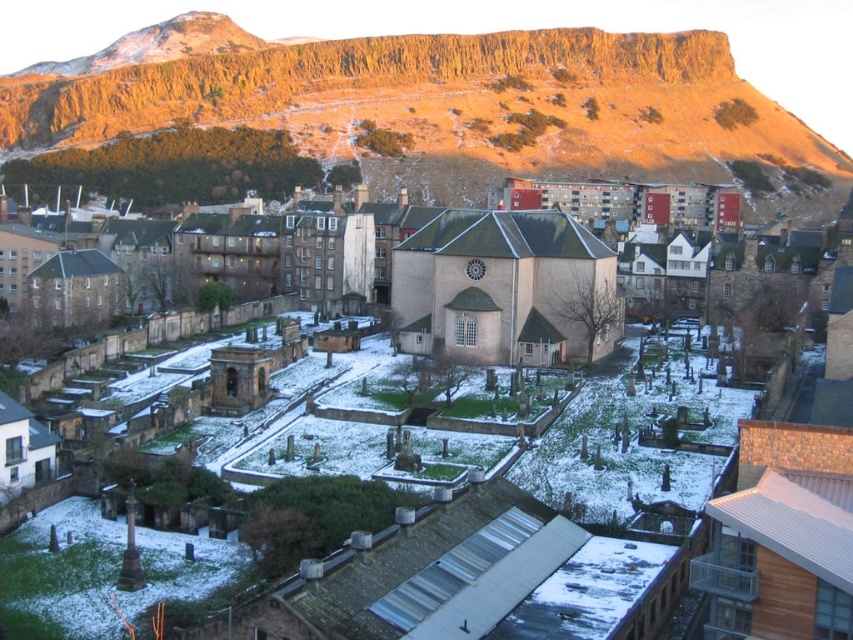
Question: Which of the following is the farthest from the observer?

Choices:
 (A) smooth stone church at center
 (B) white stone church at center
 (C) golden rock formation at upper center

Answer: (C)

Question: Which of the following is the closest to the observer?

Choices:
 (A) (316, 84)
 (B) (546, 234)

Answer: (B)

Question: Can you confirm if golden rock formation at upper center is bigger than white stone church at center?

Choices:
 (A) no
 (B) yes

Answer: (B)

Question: Estimate the real-world distances between objects in this image. Which object is closer to the smooth stone church at center?

Choices:
 (A) golden rock formation at upper center
 (B) white stone church at center

Answer: (B)

Question: Is golden rock formation at upper center smaller than smooth stone church at center?

Choices:
 (A) no
 (B) yes

Answer: (A)

Question: Is golden rock formation at upper center to the left of white stone church at center from the viewer's perspective?

Choices:
 (A) yes
 (B) no

Answer: (A)